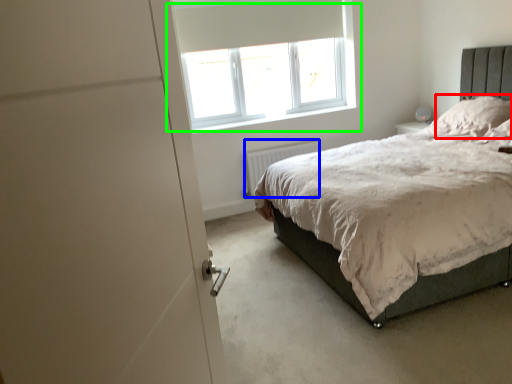
Question: Based on their relative distances, which object is farther from pillow (highlighted by a red box)? Choose from radiator (highlighted by a blue box) and window (highlighted by a green box).

Choices:
 (A) radiator
 (B) window

Answer: (B)